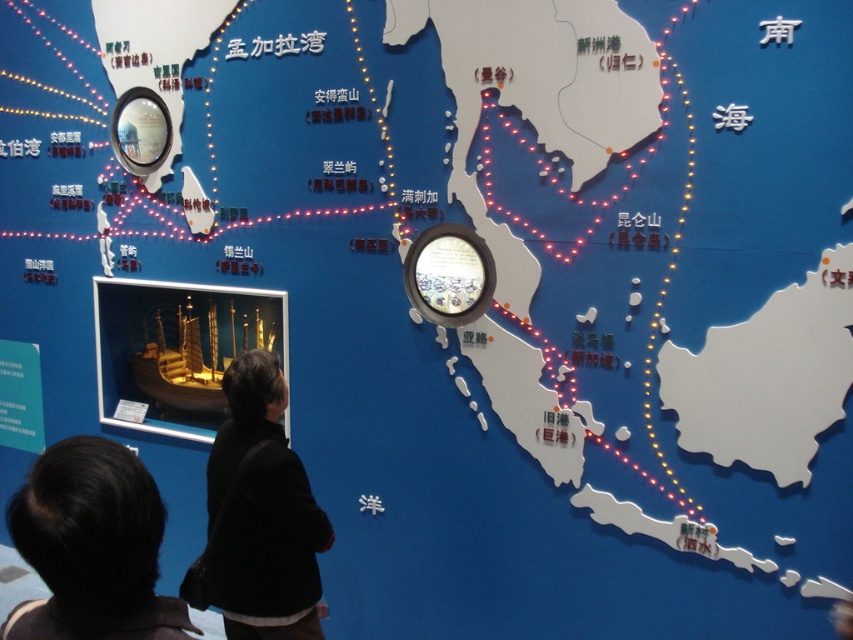
Question: Which object is the closest to the black hair at lower left?

Choices:
 (A) black fabric at lower left
 (B) wooden ship at center

Answer: (A)

Question: Estimate the real-world distances between objects in this image. Which object is closer to the wooden ship at center?

Choices:
 (A) black hair at lower left
 (B) black fabric at lower left

Answer: (B)

Question: Is black hair at lower left positioned at the back of black fabric at lower left?

Choices:
 (A) yes
 (B) no

Answer: (B)

Question: Does black fabric at lower left come behind wooden ship at center?

Choices:
 (A) no
 (B) yes

Answer: (A)

Question: Which of these objects is positioned closest to the black fabric at lower left?

Choices:
 (A) black hair at lower left
 (B) wooden ship at center

Answer: (A)

Question: Can you confirm if black hair at lower left is wider than black fabric at lower left?

Choices:
 (A) yes
 (B) no

Answer: (B)